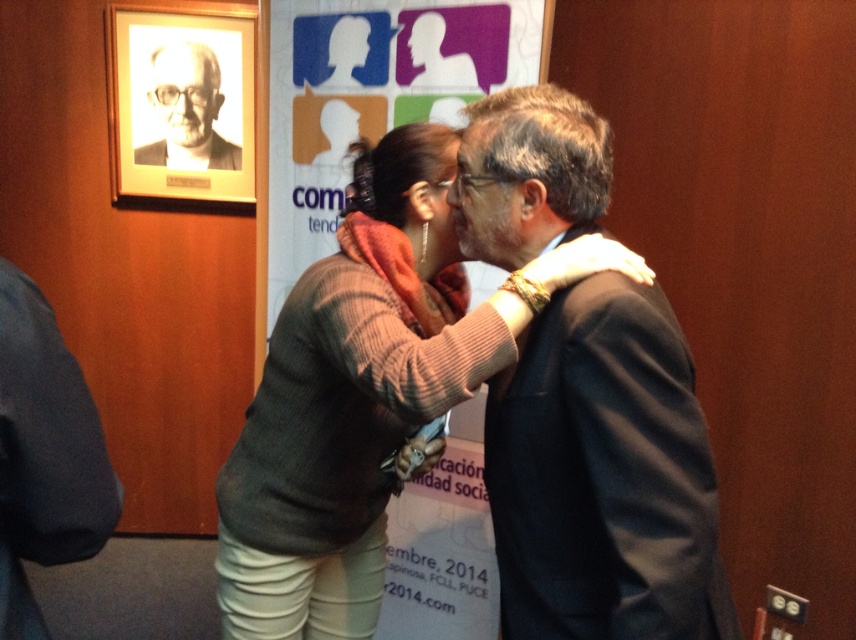
Is point (201, 164) in front of point (461, 224)?

No, it is behind (461, 224).

Does matte black portrait at upper left appear under smooth skin face at center?

Incorrect, matte black portrait at upper left is not positioned below smooth skin face at center.

Is point (209, 125) positioned after point (513, 193)?

Yes, it is.

The width and height of the screenshot is (856, 640). Find the location of `matte black portrait at upper left`. matte black portrait at upper left is located at coordinates (187, 109).

Who is positioned more to the left, dark gray sweater at center or dark gray suit at left?

dark gray suit at left

Is dark gray sweater at center to the right of dark gray suit at left from the viewer's perspective?

Indeed, dark gray sweater at center is positioned on the right side of dark gray suit at left.

Where is `dark gray sweater at center`? dark gray sweater at center is located at coordinates (348, 406).

Where is `dark gray sweater at center`? The image size is (856, 640). dark gray sweater at center is located at coordinates (348, 406).

Which of these two, white paper portrait at upper left or matte black suit at center, stands shorter?

Standing shorter between the two is matte black suit at center.

Based on the photo, is white paper portrait at upper left bigger than matte black suit at center?

Yes, white paper portrait at upper left is bigger than matte black suit at center.

Describe the element at coordinates (185, 97) in the screenshot. I see `white paper portrait at upper left` at that location.

Find the location of a particular element. white paper portrait at upper left is located at coordinates (185, 97).